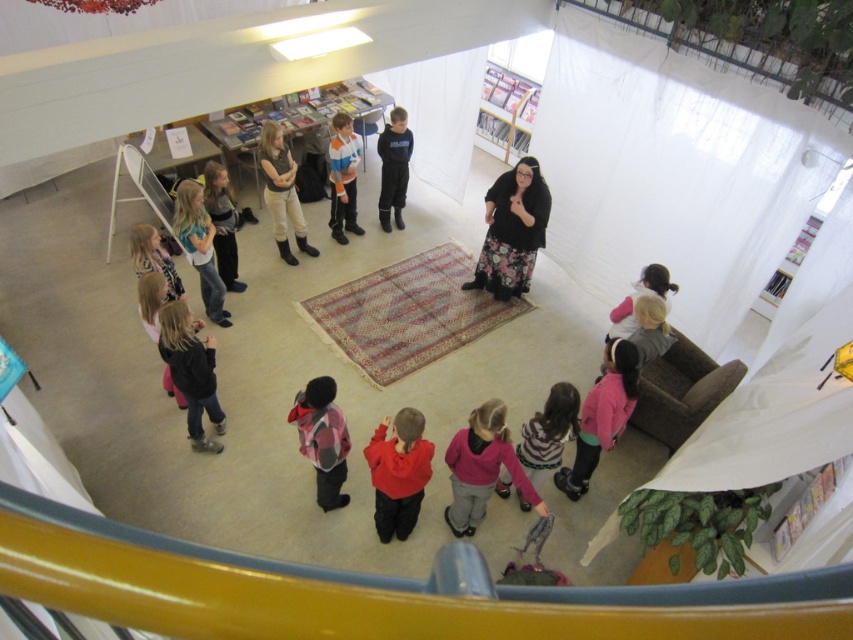
Who is higher up, red fleece jacket at center or dark gray fleece jacket at lower left?

dark gray fleece jacket at lower left

Between red fleece jacket at center and dark gray fleece jacket at lower left, which one appears on the left side from the viewer's perspective?

Positioned to the left is dark gray fleece jacket at lower left.

What do you see at coordinates (398, 472) in the screenshot?
I see `red fleece jacket at center` at bounding box center [398, 472].

Image resolution: width=853 pixels, height=640 pixels. Identify the location of red fleece jacket at center. (398, 472).

Is carpeted rug at center taller than pink fleece jacket at lower center?

Correct, carpeted rug at center is much taller as pink fleece jacket at lower center.

Who is positioned more to the left, carpeted rug at center or pink fleece jacket at lower center?

From the viewer's perspective, carpeted rug at center appears more on the left side.

Does point (370, 380) come in front of point (483, 486)?

No, it is not.

The width and height of the screenshot is (853, 640). I want to click on carpeted rug at center, so click(407, 314).

Does striped sweater at lower center have a lesser width compared to striped sweater at center?

In fact, striped sweater at lower center might be wider than striped sweater at center.

Is the position of striped sweater at lower center more distant than that of striped sweater at center?

No, striped sweater at lower center is closer to the viewer.

In order to click on striped sweater at lower center in this screenshot , I will do `click(548, 432)`.